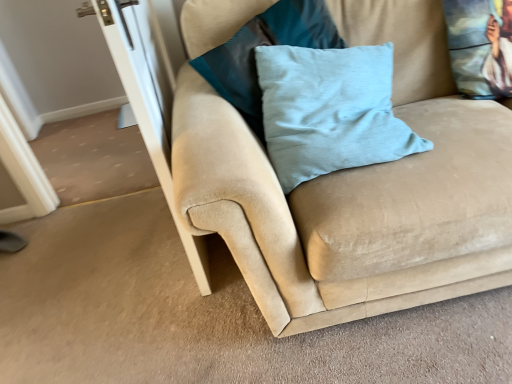
Question: Is light blue fabric pillow at center, the first pillow positioned from the left, at the left side of transparent glass screen door at left?

Choices:
 (A) no
 (B) yes

Answer: (A)

Question: Can you confirm if light blue fabric pillow at center, the first pillow positioned from the left, is wider than transparent glass screen door at left?

Choices:
 (A) no
 (B) yes

Answer: (B)

Question: Could you tell me if light blue fabric pillow at center, which ranks as the 3th pillow in right-to-left order, is facing transparent glass screen door at left?

Choices:
 (A) yes
 (B) no

Answer: (B)

Question: Considering the relative positions of light blue fabric pillow at center, which ranks as the 3th pillow in right-to-left order, and transparent glass screen door at left in the image provided, is light blue fabric pillow at center, which ranks as the 3th pillow in right-to-left order, behind transparent glass screen door at left?

Choices:
 (A) no
 (B) yes

Answer: (B)

Question: Are light blue fabric pillow at center, which ranks as the 3th pillow in right-to-left order, and transparent glass screen door at left far apart?

Choices:
 (A) yes
 (B) no

Answer: (B)

Question: Is light blue fabric pillow at center, which ranks as the 3th pillow in right-to-left order, located outside transparent glass screen door at left?

Choices:
 (A) yes
 (B) no

Answer: (A)

Question: Is suede couch at center turned away from printed fabric cushion at upper right, which appears as the first pillow when viewed from the right?

Choices:
 (A) no
 (B) yes

Answer: (B)

Question: Does suede couch at center have a larger size compared to printed fabric cushion at upper right, which is the third pillow in left-to-right order?

Choices:
 (A) yes
 (B) no

Answer: (A)

Question: Is the position of suede couch at center less distant than that of printed fabric cushion at upper right, which is the third pillow in left-to-right order?

Choices:
 (A) no
 (B) yes

Answer: (B)

Question: Considering the relative sizes of suede couch at center and printed fabric cushion at upper right, which is the third pillow in left-to-right order, in the image provided, is suede couch at center wider than printed fabric cushion at upper right, which is the third pillow in left-to-right order,?

Choices:
 (A) no
 (B) yes

Answer: (B)

Question: Is suede couch at center not near printed fabric cushion at upper right, which is the third pillow in left-to-right order?

Choices:
 (A) yes
 (B) no

Answer: (B)

Question: From the image's perspective, is suede couch at center under printed fabric cushion at upper right, which is the third pillow in left-to-right order?

Choices:
 (A) no
 (B) yes

Answer: (B)

Question: Could you tell me if suede couch at center is facing light blue velvet pillow at center, which is the 2th pillow in left-to-right order?

Choices:
 (A) yes
 (B) no

Answer: (A)